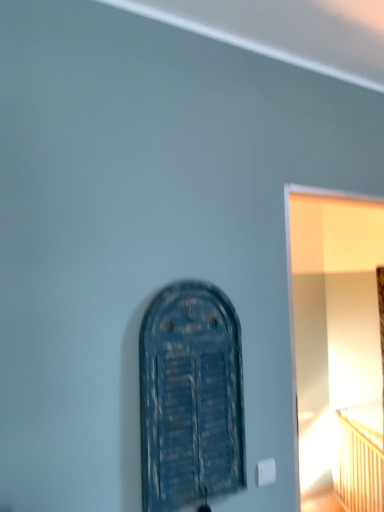
Question: Is wooden bed at right smaller than white glossy door at right?

Choices:
 (A) no
 (B) yes

Answer: (B)

Question: Is wooden bed at right to the left of white glossy door at right from the viewer's perspective?

Choices:
 (A) yes
 (B) no

Answer: (B)

Question: Is wooden bed at right wider than white glossy door at right?

Choices:
 (A) yes
 (B) no

Answer: (B)

Question: From the image's perspective, is wooden bed at right on white glossy door at right?

Choices:
 (A) no
 (B) yes

Answer: (A)

Question: From the image's perspective, is wooden bed at right under white glossy door at right?

Choices:
 (A) no
 (B) yes

Answer: (B)

Question: From the image's perspective, is wooden bed at right above or below blue wooden door at center?

Choices:
 (A) above
 (B) below

Answer: (B)

Question: Considering the positions of wooden bed at right and blue wooden door at center in the image, is wooden bed at right taller or shorter than blue wooden door at center?

Choices:
 (A) tall
 (B) short

Answer: (B)

Question: Considering the positions of point (352, 503) and point (192, 318), is point (352, 503) closer or farther from the camera than point (192, 318)?

Choices:
 (A) farther
 (B) closer

Answer: (A)

Question: Is wooden bed at right spatially inside blue wooden door at center, or outside of it?

Choices:
 (A) inside
 (B) outside

Answer: (B)

Question: Looking at their shapes, would you say wooden bed at right is wider or thinner than white glossy door at right?

Choices:
 (A) thin
 (B) wide

Answer: (A)

Question: Considering the relative positions of wooden bed at right and white glossy door at right in the image provided, is wooden bed at right to the left or to the right of white glossy door at right?

Choices:
 (A) right
 (B) left

Answer: (A)

Question: Relative to white glossy door at right, is wooden bed at right in front or behind?

Choices:
 (A) behind
 (B) front

Answer: (A)

Question: Is point (377, 464) positioned closer to the camera than point (286, 195)?

Choices:
 (A) closer
 (B) farther

Answer: (B)

Question: From the image's perspective, is blue wooden door at center above or below wooden bed at right?

Choices:
 (A) above
 (B) below

Answer: (A)

Question: Is blue wooden door at center bigger or smaller than wooden bed at right?

Choices:
 (A) big
 (B) small

Answer: (B)